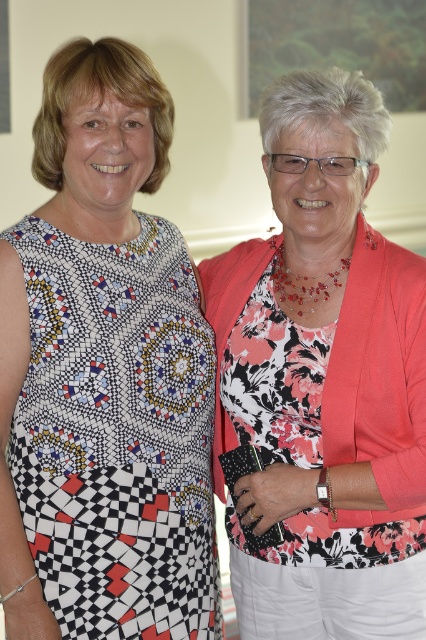
Question: Is printed fabric dress at center above floral fabric dress at right?

Choices:
 (A) no
 (B) yes

Answer: (B)

Question: Is printed fabric dress at center thinner than floral fabric dress at right?

Choices:
 (A) no
 (B) yes

Answer: (B)

Question: Is printed fabric dress at center positioned in front of floral fabric dress at right?

Choices:
 (A) no
 (B) yes

Answer: (B)

Question: Which object appears closest to the camera in this image?

Choices:
 (A) floral fabric dress at right
 (B) printed fabric dress at center

Answer: (B)

Question: Which object appears closest to the camera in this image?

Choices:
 (A) printed fabric dress at center
 (B) floral fabric dress at right

Answer: (A)